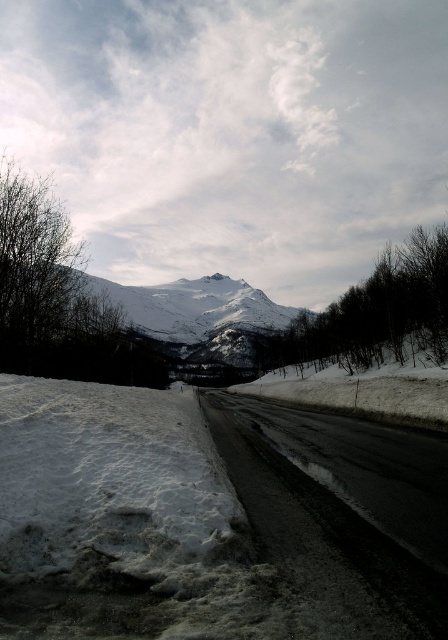
You are a hiker planning to walk from the snowy rocky mountain at center to the white fluffy snow at lower left. Which direction should you head?

The white fluffy snow at lower left is to the right of the snowy rocky mountain at center, so you should head to the right.

You are a photographer planning to capture the white fluffy snow at lower left and the snowy rocky mountain at center in a single frame. Based on their sizes, which object should you focus on to ensure both are visible without cropping?

The white fluffy snow at lower left has a smaller size compared to snowy rocky mountain at center. To ensure both are visible without cropping, focus on the snowy rocky mountain at center as the primary subject while keeping the white fluffy snow at lower left in the foreground or background for balance.